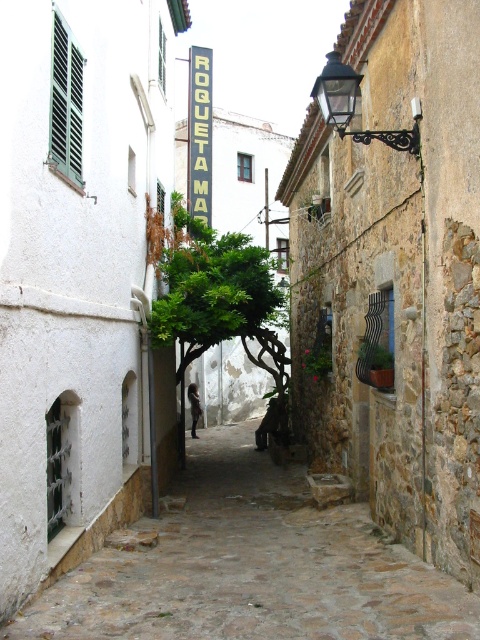
Based on the photo, you are standing at the entrance of the alleyway and want to walk straight ahead. Where is the stone paved path at center located relative to your position?

The stone paved path at center is located at point (250,566) relative to your position.

You are standing at the entrance of the narrow cobblestone alleyway. You see a stone paved path at center marked by a point at coordinates [250,566]. If you walk straight ahead, will you eventually reach the end of the alleyway?

Yes, the point at coordinates [250,566] indicates the stone paved path at center, so walking straight ahead along the path will lead you to the end of the alleyway.

You are a delivery person trying to navigate through the narrow alleyway. You see the stone paved path at center and the green leafy tree at center. Which object is closer to the ground?

The stone paved path at center is below green leafy tree at center, so the stone paved path at center is closer to the ground.